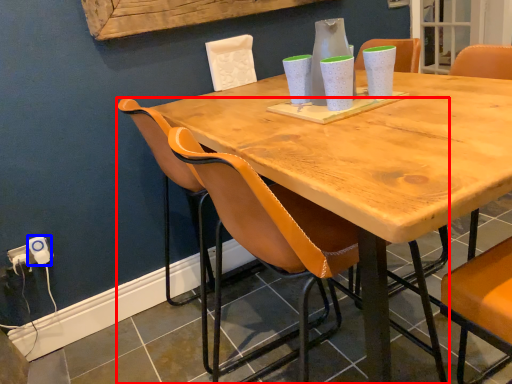
Question: Which object appears farthest to the camera in this image, chair (highlighted by a red box) or electric outlet (highlighted by a blue box)?

Choices:
 (A) chair
 (B) electric outlet

Answer: (B)